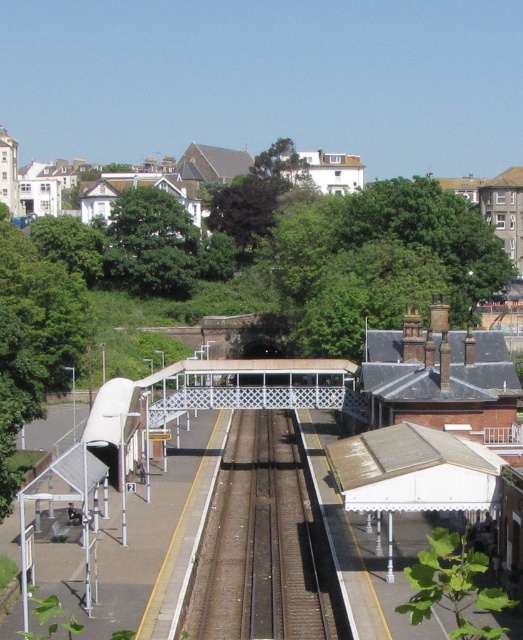
Does smooth metal train track at center have a smaller size compared to metallic silver train at left?

Yes.

Is smooth metal train track at center behind metallic silver train at left?

No, it is in front of metallic silver train at left.

What do you see at coordinates (262, 541) in the screenshot? I see `smooth metal train track at center` at bounding box center [262, 541].

Locate an element on the screen. Image resolution: width=523 pixels, height=640 pixels. smooth metal train track at center is located at coordinates (262, 541).

Is white textured canopy at center taller than smooth metal train track at center?

Answer: Yes.

Can you confirm if white textured canopy at center is positioned below smooth metal train track at center?

Actually, white textured canopy at center is above smooth metal train track at center.

Find the location of `white textured canopy at center`. white textured canopy at center is located at coordinates (337, 403).

Where is `white textured canopy at center`? The width and height of the screenshot is (523, 640). white textured canopy at center is located at coordinates (337, 403).

Who is positioned more to the left, white textured canopy at center or green leafy tree at lower right?

white textured canopy at center is more to the left.

In the scene shown: Does white textured canopy at center have a lesser height compared to green leafy tree at lower right?

Incorrect, white textured canopy at center's height does not fall short of green leafy tree at lower right's.

At what (x,y) coordinates should I click in order to perform the action: click on white textured canopy at center. Please return your answer as a coordinate pair (x, y). This screenshot has width=523, height=640. Looking at the image, I should click on (337, 403).